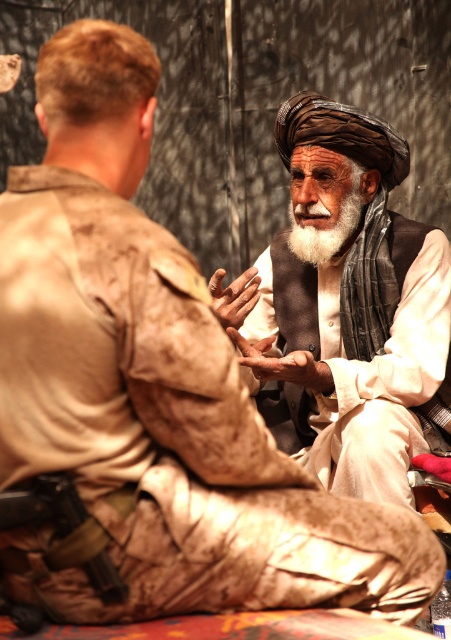
You are a photographer trying to capture a clear shot of both the brown woven turban at center and the whitewoollybeard at center. Which object should you focus on first to ensure both are in focus?

The brown woven turban at center is closer to the viewer than the whitewoollybeard at center. To ensure both are in focus, focus on the brown woven turban at center first, as it is closer, and adjust the depth of field to include the whitewoollybeard at center.

You are a photographer trying to capture a closeup of the brown woven turban at center without including the camouflage uniform at right in the frame. Based on their positions, is this possible?

The camouflage uniform at right is to the left of brown woven turban at center, so the photographer can position the camera to focus on the brown woven turban at center while avoiding the camouflage uniform at right by angling the shot to the right side of the scene.